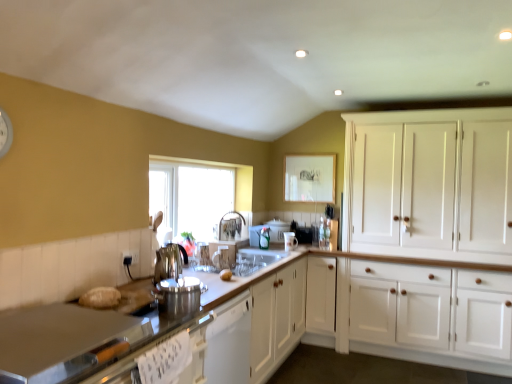
Question: Is clear glass window at center bigger than white plastic toaster at center, the 2th appliance when ordered from back to front?

Choices:
 (A) yes
 (B) no

Answer: (A)

Question: Could white plastic toaster at center, the 2th appliance when ordered from back to front, be considered to be inside clear glass window at center?

Choices:
 (A) no
 (B) yes

Answer: (A)

Question: Is there a large distance between clear glass window at center and white plastic toaster at center, the third appliance viewed from the left?

Choices:
 (A) no
 (B) yes

Answer: (A)

Question: From the image's perspective, would you say clear glass window at center is positioned over white plastic toaster at center, the 3th appliance when ordered from right to left?

Choices:
 (A) no
 (B) yes

Answer: (B)

Question: Can you confirm if clear glass window at center is wider than white plastic toaster at center, which is the 4th appliance from front to back?

Choices:
 (A) yes
 (B) no

Answer: (B)

Question: Would you say clear glass window at center is to the left or to the right of satin silver kettle at center, the 5th appliance from the back, in the picture?

Choices:
 (A) left
 (B) right

Answer: (A)

Question: Is clear glass window at center inside the boundaries of satin silver kettle at center, which appears as the fourth appliance when viewed from the right, or outside?

Choices:
 (A) outside
 (B) inside

Answer: (A)

Question: Is clear glass window at center taller or shorter than satin silver kettle at center, the 5th appliance from the back?

Choices:
 (A) tall
 (B) short

Answer: (A)

Question: From the image's perspective, relative to satin silver kettle at center, the 5th appliance from the back, is clear glass window at center above or below?

Choices:
 (A) above
 (B) below

Answer: (A)

Question: In the image, is polished stainless steel faucet at center positioned in front of or behind polished stainless steel kettle at center, the first appliance when ordered from left to right?

Choices:
 (A) front
 (B) behind

Answer: (B)

Question: Considering the positions of polished stainless steel faucet at center and polished stainless steel kettle at center, the first appliance when ordered from left to right, in the image, is polished stainless steel faucet at center bigger or smaller than polished stainless steel kettle at center, the first appliance when ordered from left to right,?

Choices:
 (A) big
 (B) small

Answer: (A)

Question: Considering the relative positions of polished stainless steel faucet at center and polished stainless steel kettle at center, the first appliance when ordered from left to right, in the image provided, is polished stainless steel faucet at center to the left or to the right of polished stainless steel kettle at center, the first appliance when ordered from left to right,?

Choices:
 (A) left
 (B) right

Answer: (B)

Question: From a real-world perspective, is polished stainless steel faucet at center physically located above or below polished stainless steel kettle at center, the second appliance viewed from the front?

Choices:
 (A) above
 (B) below

Answer: (A)

Question: Looking at their shapes, would you say polished stainless steel kettle at center, the second appliance viewed from the front, is wider or thinner than white glossy mug at center, positioned as the third appliance in front-to-back order?

Choices:
 (A) thin
 (B) wide

Answer: (B)

Question: From a real-world perspective, is polished stainless steel kettle at center, the fourth appliance viewed from the back, positioned above or below white glossy mug at center, positioned as the third appliance in front-to-back order?

Choices:
 (A) below
 (B) above

Answer: (B)